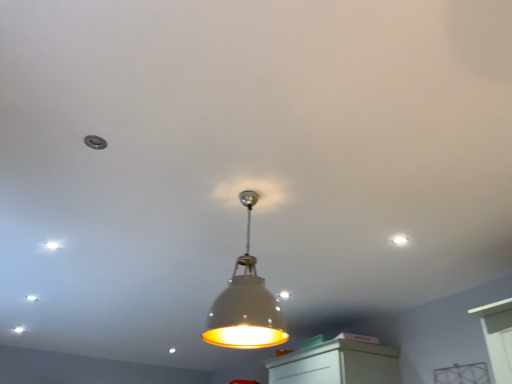
Question: Is white glossy dot at upper left, the second dot viewed from the front, taller than white matte lampshade at center?

Choices:
 (A) yes
 (B) no

Answer: (B)

Question: Can we say white glossy dot at upper left, the 1th dot from the bottom, lies outside white matte lampshade at center?

Choices:
 (A) yes
 (B) no

Answer: (A)

Question: Can you confirm if white glossy dot at upper left, the second dot positioned from the top, is thinner than white matte lampshade at center?

Choices:
 (A) no
 (B) yes

Answer: (B)

Question: Does white glossy dot at upper left, the 1th dot in the back-to-front sequence, appear on the right side of white matte lampshade at center?

Choices:
 (A) no
 (B) yes

Answer: (A)

Question: Can you confirm if white glossy dot at upper left, the 1th dot in the back-to-front sequence, is wider than white matte lampshade at center?

Choices:
 (A) yes
 (B) no

Answer: (B)

Question: From the image's perspective, is white glossy dot at upper left, which is the second dot in right-to-left order, positioned above or below white matte light fixture at upper center, the 1th dot when ordered from right to left?

Choices:
 (A) below
 (B) above

Answer: (A)

Question: From a real-world perspective, is white glossy dot at upper left, which ranks as the 1th dot in left-to-right order, positioned above or below white matte light fixture at upper center, the 1th dot when ordered from right to left?

Choices:
 (A) below
 (B) above

Answer: (A)

Question: Is white glossy dot at upper left, the 1th dot from the bottom, taller or shorter than white matte light fixture at upper center, the 1th dot when ordered from right to left?

Choices:
 (A) short
 (B) tall

Answer: (B)

Question: Is white glossy dot at upper left, the 1th dot in the back-to-front sequence, in front of or behind white matte light fixture at upper center, arranged as the 2th dot when viewed from the back, in the image?

Choices:
 (A) front
 (B) behind

Answer: (B)

Question: Relative to white glossy dot at upper left, the second dot positioned from the top, is white matte light fixture at upper center, arranged as the 2th dot when viewed from the back, in front or behind?

Choices:
 (A) front
 (B) behind

Answer: (A)

Question: Is white matte light fixture at upper center, the first dot when ordered from front to back, wider or thinner than white glossy dot at upper left, which ranks as the 1th dot in left-to-right order?

Choices:
 (A) wide
 (B) thin

Answer: (A)

Question: From a real-world perspective, is white matte light fixture at upper center, arranged as the 2th dot when viewed from the back, physically located above or below white glossy dot at upper left, the second dot positioned from the top?

Choices:
 (A) above
 (B) below

Answer: (A)

Question: From the image's perspective, relative to white glossy dot at upper left, the 1th dot in the back-to-front sequence, is white matte light fixture at upper center, the first dot when ordered from top to bottom, above or below?

Choices:
 (A) above
 (B) below

Answer: (A)

Question: Is point (257, 309) positioned closer to the camera than point (50, 246)?

Choices:
 (A) farther
 (B) closer

Answer: (B)

Question: From a real-world perspective, is white matte lampshade at center above or below white glossy dot at upper left, the 1th dot in the back-to-front sequence?

Choices:
 (A) above
 (B) below

Answer: (B)